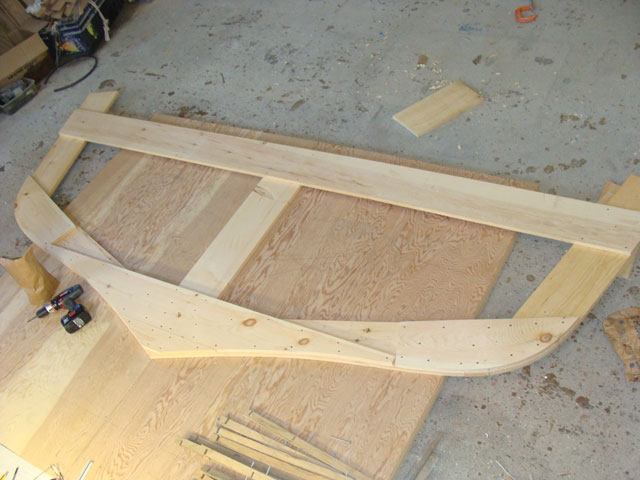
I want to click on right side of floor, so click(x=504, y=428).